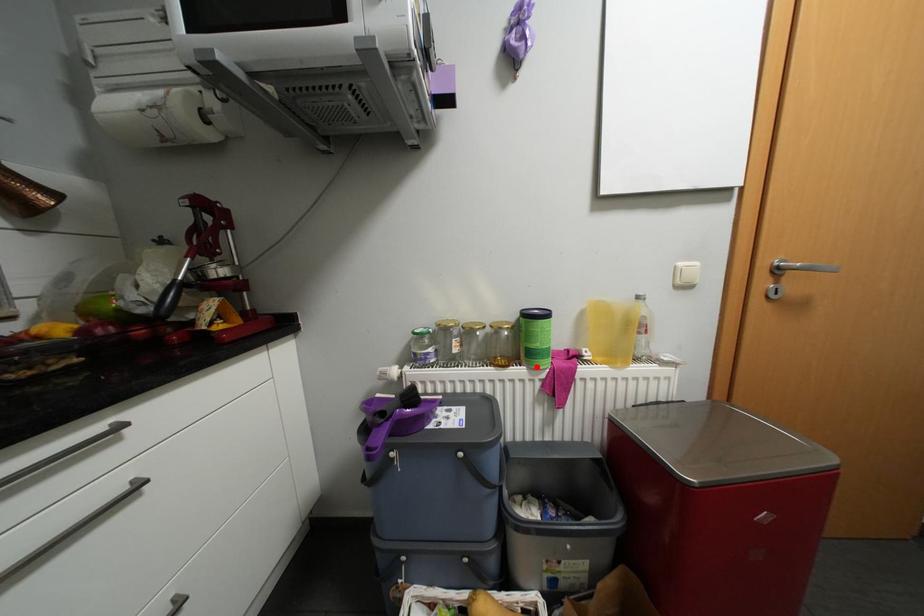
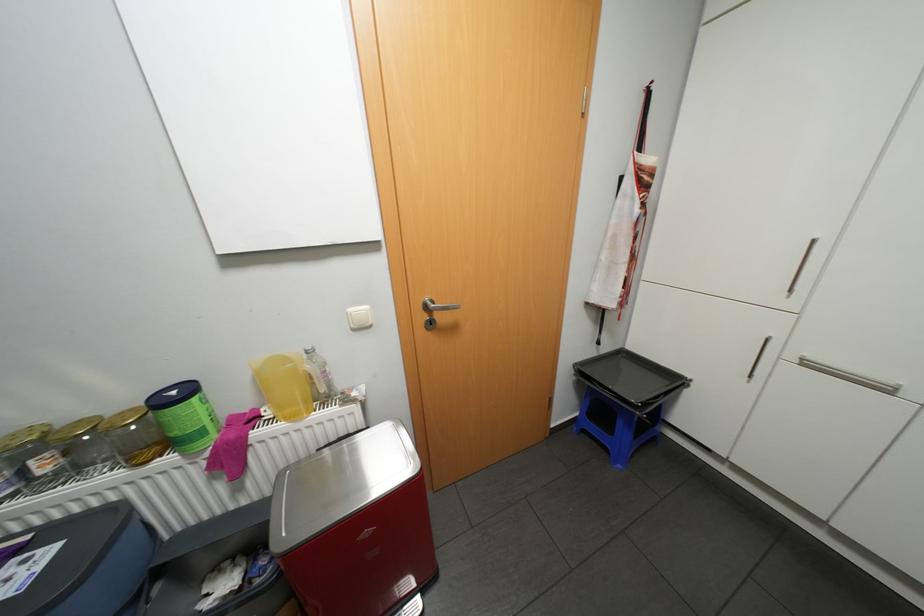
Where in the second image is the point corresponding to the highlighted location from the first image?

(190, 453)